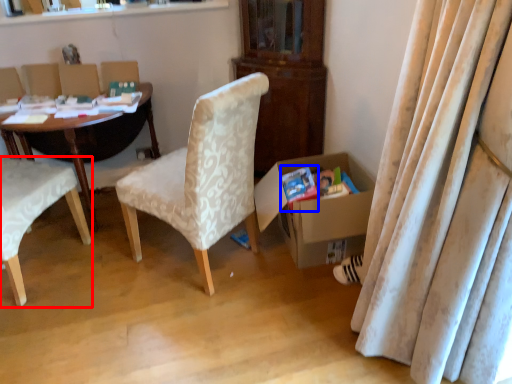
Question: Among these objects, which one is nearest to the camera, chair (highlighted by a red box) or paperback book (highlighted by a blue box)?

Choices:
 (A) chair
 (B) paperback book

Answer: (A)